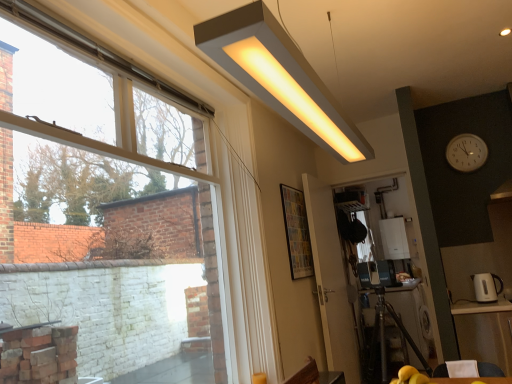
Question: Is transparent glass window at upper left inside white plastic clock at upper right?

Choices:
 (A) no
 (B) yes

Answer: (A)

Question: Does white plastic clock at upper right have a greater height compared to transparent glass window at upper left?

Choices:
 (A) no
 (B) yes

Answer: (A)

Question: Is the depth of white plastic clock at upper right greater than that of transparent glass window at upper left?

Choices:
 (A) no
 (B) yes

Answer: (B)

Question: From the image's perspective, is white plastic clock at upper right over transparent glass window at upper left?

Choices:
 (A) yes
 (B) no

Answer: (A)

Question: Does white plastic clock at upper right have a lesser height compared to transparent glass window at upper left?

Choices:
 (A) no
 (B) yes

Answer: (B)

Question: From a real-world perspective, relative to matte white rectangular light fixture at upper center, is wooden table at lower right, acting as the first table starting from the front, vertically above or below?

Choices:
 (A) below
 (B) above

Answer: (A)

Question: Looking at their shapes, would you say wooden table at lower right, which is the second table in back-to-front order, is wider or thinner than matte white rectangular light fixture at upper center?

Choices:
 (A) wide
 (B) thin

Answer: (B)

Question: Is wooden table at lower right, acting as the first table starting from the front, spatially inside matte white rectangular light fixture at upper center, or outside of it?

Choices:
 (A) inside
 (B) outside

Answer: (B)

Question: Is wooden table at lower right, acting as the first table starting from the front, taller or shorter than matte white rectangular light fixture at upper center?

Choices:
 (A) short
 (B) tall

Answer: (A)

Question: From the image's perspective, is transparent glass window at upper left located above or below white glossy screen door at lower right, which is the second screen door in left-to-right order?

Choices:
 (A) below
 (B) above

Answer: (B)

Question: Based on their positions, is transparent glass window at upper left located to the left or right of white glossy screen door at lower right, positioned as the first screen door in right-to-left order?

Choices:
 (A) right
 (B) left

Answer: (B)

Question: Is transparent glass window at upper left wider or thinner than white glossy screen door at lower right, which is the second screen door in left-to-right order?

Choices:
 (A) wide
 (B) thin

Answer: (A)

Question: In terms of height, does transparent glass window at upper left look taller or shorter compared to white glossy screen door at lower right, which is the second screen door in left-to-right order?

Choices:
 (A) short
 (B) tall

Answer: (A)

Question: Is white glossy boiler at center, marked as the second appliance in a left-to-right arrangement, taller or shorter than white glossy electric kettle at right, which is the second appliance from back to front?

Choices:
 (A) short
 (B) tall

Answer: (B)

Question: Based on their positions, is white glossy boiler at center, marked as the second appliance in a left-to-right arrangement, located to the left or right of white glossy electric kettle at right, which is the second appliance from back to front?

Choices:
 (A) left
 (B) right

Answer: (B)